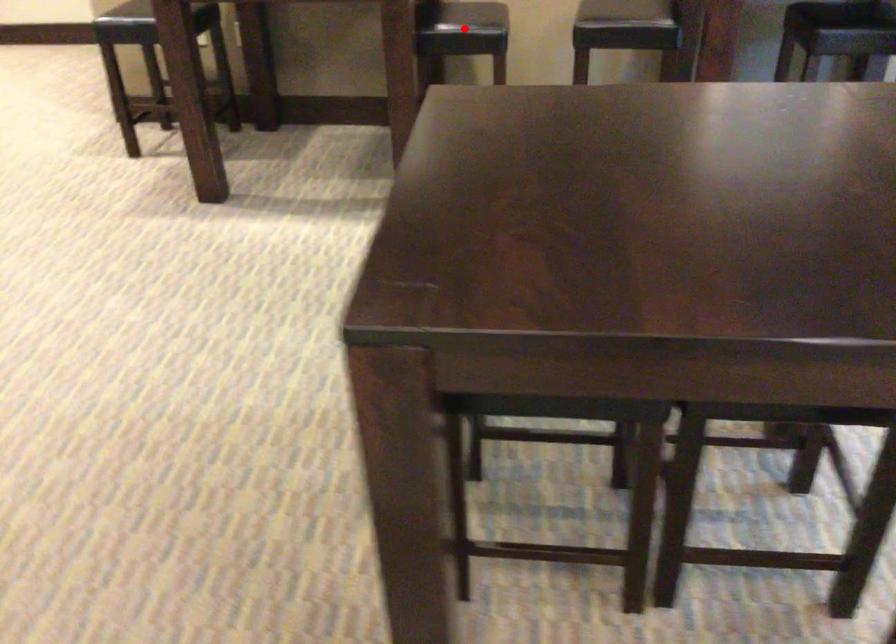
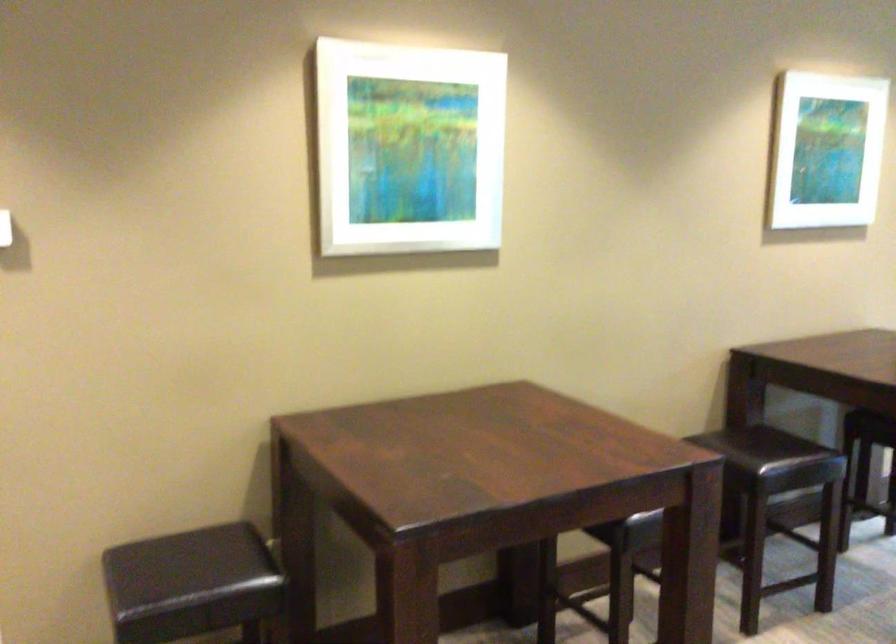
Question: I am providing you with two images of the same scene from different viewpoints. A red point is marked on the first image. Can you still see the location of the red point in image 2?

Choices:
 (A) Yes
 (B) No

Answer: (B)